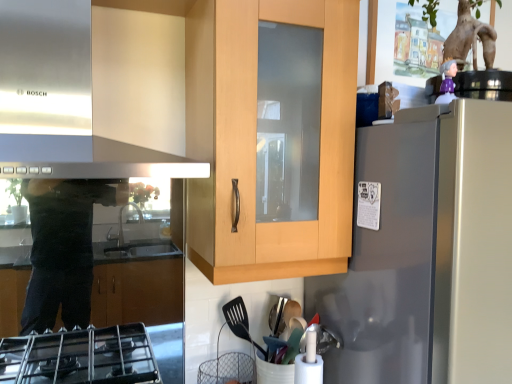
The image size is (512, 384). Find the location of `satin silver refrigerator at right`. satin silver refrigerator at right is located at coordinates (428, 253).

What do you see at coordinates (428, 253) in the screenshot?
I see `satin silver refrigerator at right` at bounding box center [428, 253].

This screenshot has height=384, width=512. Describe the element at coordinates (92, 93) in the screenshot. I see `stainless steel exhaust hood at upper left` at that location.

Find the location of a particular element. stainless steel exhaust hood at upper left is located at coordinates (92, 93).

Image resolution: width=512 pixels, height=384 pixels. Identify the location of satin silver refrigerator at right. (428, 253).

Based on their positions, is stainless steel exhaust hood at upper left located to the left or right of satin silver refrigerator at right?

From the image, it's evident that stainless steel exhaust hood at upper left is to the left of satin silver refrigerator at right.

Does stainless steel exhaust hood at upper left lie in front of satin silver refrigerator at right?

Yes, stainless steel exhaust hood at upper left is closer to the viewer.

Considering the positions of point (185, 168) and point (504, 206), is point (185, 168) closer or farther from the camera than point (504, 206)?

Point (185, 168) is closer to the camera than point (504, 206).

From the image's perspective, is stainless steel exhaust hood at upper left located above satin silver refrigerator at right?

Yes, from the image's perspective, stainless steel exhaust hood at upper left is on top of satin silver refrigerator at right.

From a real-world perspective, is stainless steel exhaust hood at upper left on satin silver refrigerator at right?

Correct, in the physical world, stainless steel exhaust hood at upper left is higher than satin silver refrigerator at right.

Is stainless steel exhaust hood at upper left wider than satin silver refrigerator at right?

Incorrect, the width of stainless steel exhaust hood at upper left does not surpass that of satin silver refrigerator at right.

Is stainless steel exhaust hood at upper left shorter than satin silver refrigerator at right?

Indeed, stainless steel exhaust hood at upper left has a lesser height compared to satin silver refrigerator at right.

In the scene shown: Looking at the image, does stainless steel exhaust hood at upper left seem bigger or smaller compared to satin silver refrigerator at right?

Considering their sizes, stainless steel exhaust hood at upper left takes up less space than satin silver refrigerator at right.

Looking at this image, which is correct: stainless steel exhaust hood at upper left is inside satin silver refrigerator at right, or outside of it?

stainless steel exhaust hood at upper left exists outside the volume of satin silver refrigerator at right.

Can you see stainless steel exhaust hood at upper left touching satin silver refrigerator at right?

There is a gap between stainless steel exhaust hood at upper left and satin silver refrigerator at right.

Does stainless steel exhaust hood at upper left turn towards satin silver refrigerator at right?

No, stainless steel exhaust hood at upper left is not facing towards satin silver refrigerator at right.

Where is `refrigerator located behind the stainless steel exhaust hood at upper left`? This screenshot has width=512, height=384. refrigerator located behind the stainless steel exhaust hood at upper left is located at coordinates (428, 253).

Is satin silver refrigerator at right at the left side of stainless steel exhaust hood at upper left?

Incorrect, satin silver refrigerator at right is not on the left side of stainless steel exhaust hood at upper left.

Which object is closer to the camera taking this photo, satin silver refrigerator at right or stainless steel exhaust hood at upper left?

Positioned in front is stainless steel exhaust hood at upper left.

Which is nearer, (464, 375) or (66, 56)?

The point (464, 375) is more forward.

From the image's perspective, is satin silver refrigerator at right beneath stainless steel exhaust hood at upper left?

Yes, from the image's perspective, satin silver refrigerator at right is beneath stainless steel exhaust hood at upper left.

From a real-world perspective, between satin silver refrigerator at right and stainless steel exhaust hood at upper left, who is vertically higher?

From a 3D spatial view, stainless steel exhaust hood at upper left is above.

From the picture: Can you confirm if satin silver refrigerator at right is wider than stainless steel exhaust hood at upper left?

Yes.

Considering the sizes of objects satin silver refrigerator at right and stainless steel exhaust hood at upper left in the image provided, who is shorter, satin silver refrigerator at right or stainless steel exhaust hood at upper left?

With less height is stainless steel exhaust hood at upper left.

Is satin silver refrigerator at right bigger or smaller than stainless steel exhaust hood at upper left?

Clearly, satin silver refrigerator at right is larger in size than stainless steel exhaust hood at upper left.

Choose the correct answer: Is satin silver refrigerator at right inside stainless steel exhaust hood at upper left or outside it?

satin silver refrigerator at right is located beyond the bounds of stainless steel exhaust hood at upper left.

Does satin silver refrigerator at right touch stainless steel exhaust hood at upper left?

satin silver refrigerator at right and stainless steel exhaust hood at upper left are not in contact.

Consider the image. Is stainless steel exhaust hood at upper left at the back of satin silver refrigerator at right?

That's not correct — satin silver refrigerator at right is not looking away from stainless steel exhaust hood at upper left.

Where is `refrigerator located behind the stainless steel exhaust hood at upper left`? This screenshot has width=512, height=384. refrigerator located behind the stainless steel exhaust hood at upper left is located at coordinates (428, 253).

The height and width of the screenshot is (384, 512). I want to click on exhaust hood on the left side of satin silver refrigerator at right, so click(92, 93).

What are the coordinates of `exhaust hood in front of the satin silver refrigerator at right` in the screenshot? It's located at pos(92,93).